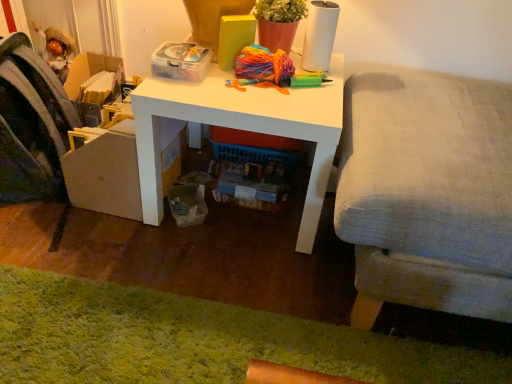
Question: From the image's perspective, is green shaggy rug at lower left located beneath velvet fabric swivel chair at left?

Choices:
 (A) no
 (B) yes

Answer: (B)

Question: Considering the relative sizes of green shaggy rug at lower left and velvet fabric swivel chair at left in the image provided, is green shaggy rug at lower left bigger than velvet fabric swivel chair at left?

Choices:
 (A) no
 (B) yes

Answer: (A)

Question: From a real-world perspective, is green shaggy rug at lower left over velvet fabric swivel chair at left?

Choices:
 (A) no
 (B) yes

Answer: (A)

Question: Can you confirm if green shaggy rug at lower left is smaller than velvet fabric swivel chair at left?

Choices:
 (A) no
 (B) yes

Answer: (B)

Question: Is green shaggy rug at lower left thinner than velvet fabric swivel chair at left?

Choices:
 (A) yes
 (B) no

Answer: (A)

Question: Is green shaggy rug at lower left at the left side of velvet fabric swivel chair at left?

Choices:
 (A) no
 (B) yes

Answer: (A)

Question: From the image's perspective, would you say white matte desk at center is shown under light gray fabric couch at right?

Choices:
 (A) yes
 (B) no

Answer: (B)

Question: Is white matte desk at center not within light gray fabric couch at right?

Choices:
 (A) no
 (B) yes

Answer: (B)

Question: Is white matte desk at center smaller than light gray fabric couch at right?

Choices:
 (A) no
 (B) yes

Answer: (B)

Question: Is white matte desk at center not near light gray fabric couch at right?

Choices:
 (A) yes
 (B) no

Answer: (B)

Question: Is white matte desk at center facing towards light gray fabric couch at right?

Choices:
 (A) yes
 (B) no

Answer: (B)

Question: Is light gray fabric couch at right completely or partially inside white matte desk at center?

Choices:
 (A) yes
 (B) no

Answer: (B)

Question: Is green shaggy rug at lower left to the left of white matte desk at center from the viewer's perspective?

Choices:
 (A) yes
 (B) no

Answer: (A)